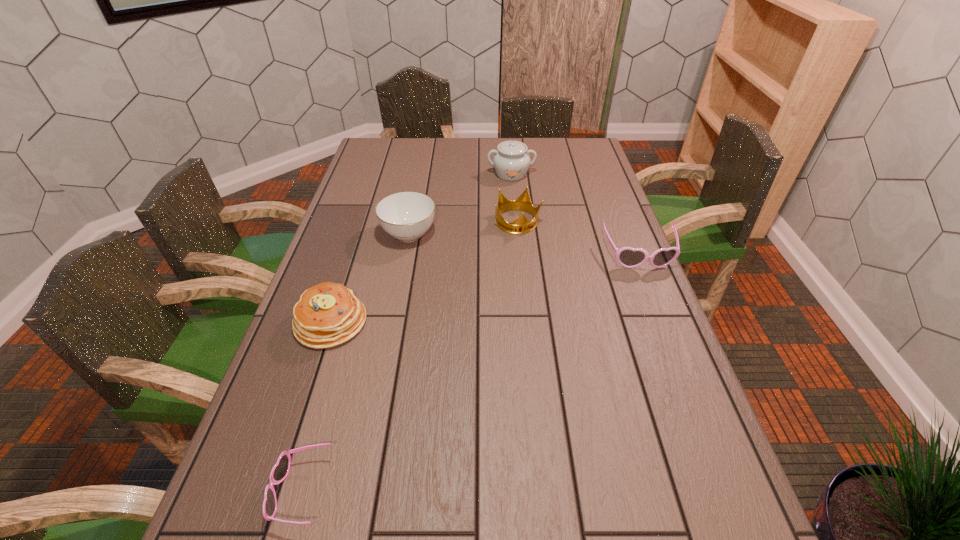
This screenshot has height=540, width=960. I want to click on chinaware present at the left edge, so click(406, 216).

I want to click on pancake positioned at the left edge, so click(328, 314).

Find the location of a particular element. Image resolution: width=960 pixels, height=540 pixels. object at the right edge is located at coordinates (628, 257).

Where is `object that is at the near left corner`? The width and height of the screenshot is (960, 540). object that is at the near left corner is located at coordinates (280, 470).

Find the location of `vacant space at the far edge of the desktop`. vacant space at the far edge of the desktop is located at coordinates (446, 152).

You are a GUI agent. You are given a task and a screenshot of the screen. Output one action in this format:
    pyautogui.click(x=<x>, y=<y>)
    Task: Click on the free space at the left edge of the desktop
    The width and height of the screenshot is (960, 540).
    Given the screenshot: What is the action you would take?
    pyautogui.click(x=382, y=186)

The image size is (960, 540). Identify the location of vacant region at the right edge. (585, 244).

Find the location of a particular element. The image size is (960, 540). vacant region at the near right corner of the desktop is located at coordinates (699, 502).

Where is `free space between the pancake and the farther chinaware`? The width and height of the screenshot is (960, 540). free space between the pancake and the farther chinaware is located at coordinates (421, 248).

Where is `free space between the crown and the shortest object`? The width and height of the screenshot is (960, 540). free space between the crown and the shortest object is located at coordinates (409, 357).